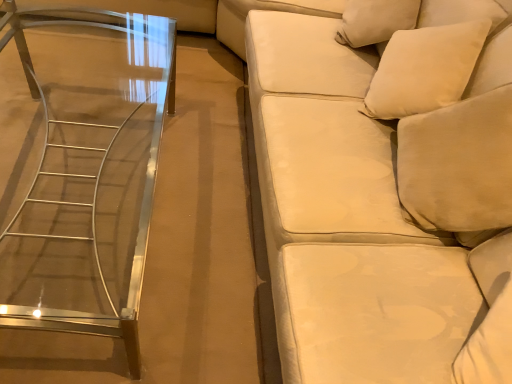
Question: Is velvet beige studio couch at right beside white soft pillow at upper right?

Choices:
 (A) yes
 (B) no

Answer: (B)

Question: Does velvet beige studio couch at right have a lesser width compared to white soft pillow at upper right?

Choices:
 (A) no
 (B) yes

Answer: (A)

Question: From the image's perspective, is velvet beige studio couch at right over white soft pillow at upper right?

Choices:
 (A) no
 (B) yes

Answer: (A)

Question: Can you confirm if velvet beige studio couch at right is positioned to the right of white soft pillow at upper right?

Choices:
 (A) yes
 (B) no

Answer: (B)

Question: Is velvet beige studio couch at right further to camera compared to white soft pillow at upper right?

Choices:
 (A) no
 (B) yes

Answer: (A)

Question: Is velvet beige studio couch at right oriented away from white soft pillow at upper right?

Choices:
 (A) no
 (B) yes

Answer: (B)

Question: Does clear glass table at left contain velvet beige studio couch at right?

Choices:
 (A) yes
 (B) no

Answer: (B)

Question: From a real-world perspective, is clear glass table at left physically above velvet beige studio couch at right?

Choices:
 (A) yes
 (B) no

Answer: (B)

Question: Considering the relative sizes of clear glass table at left and velvet beige studio couch at right in the image provided, is clear glass table at left wider than velvet beige studio couch at right?

Choices:
 (A) yes
 (B) no

Answer: (B)

Question: Could you tell me if clear glass table at left is facing velvet beige studio couch at right?

Choices:
 (A) no
 (B) yes

Answer: (A)

Question: Considering the relative sizes of clear glass table at left and velvet beige studio couch at right in the image provided, is clear glass table at left thinner than velvet beige studio couch at right?

Choices:
 (A) yes
 (B) no

Answer: (A)

Question: From the image's perspective, would you say clear glass table at left is positioned over velvet beige studio couch at right?

Choices:
 (A) no
 (B) yes

Answer: (A)

Question: Is clear glass table at left to the left of white soft pillow at upper right from the viewer's perspective?

Choices:
 (A) yes
 (B) no

Answer: (A)